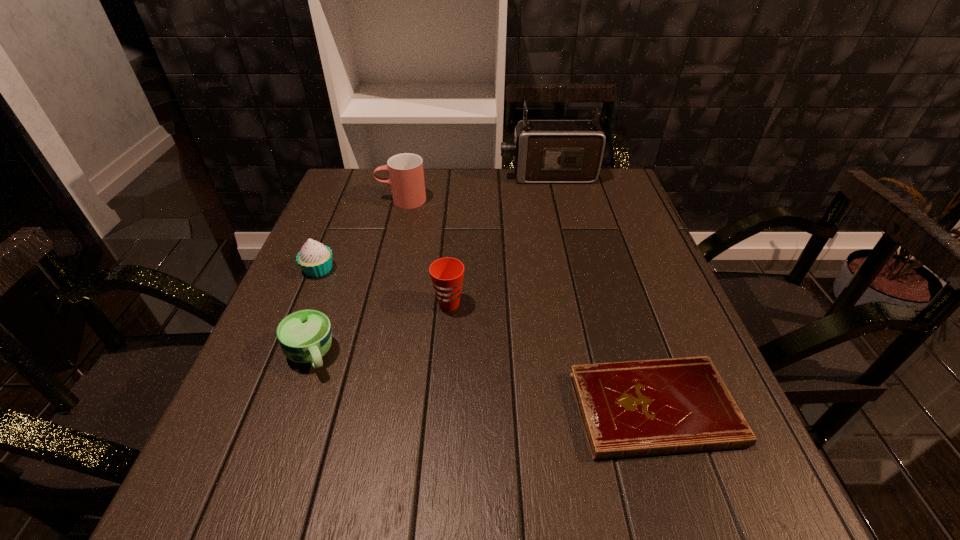
I want to click on notebook, so click(665, 406).

The height and width of the screenshot is (540, 960). I want to click on free location located at the lens of the camcorder, so click(376, 176).

Image resolution: width=960 pixels, height=540 pixels. I want to click on vacant space positioned at the lens of the camcorder, so click(x=437, y=176).

In order to click on vacant space located 0.080m at the lens of the camcorder in this screenshot , I will do `click(473, 176)`.

Find the location of a particular element. Image resolution: width=960 pixels, height=540 pixels. vacant area situated 0.080m on the side of the farthest cup with the handle is located at coordinates (349, 200).

The height and width of the screenshot is (540, 960). Find the location of `free space located 0.270m on the back of the second nearest cup`. free space located 0.270m on the back of the second nearest cup is located at coordinates (455, 221).

Locate an element on the screen. The image size is (960, 540). free space located 0.150m on the right of the third farthest object is located at coordinates (401, 269).

The image size is (960, 540). I want to click on free space located 0.300m on the right of the shortest cup, so click(x=496, y=355).

The image size is (960, 540). Find the location of `vacant region located on the left of the notebook`. vacant region located on the left of the notebook is located at coordinates (474, 409).

Locate an element on the screen. camcorder at the far edge is located at coordinates (544, 151).